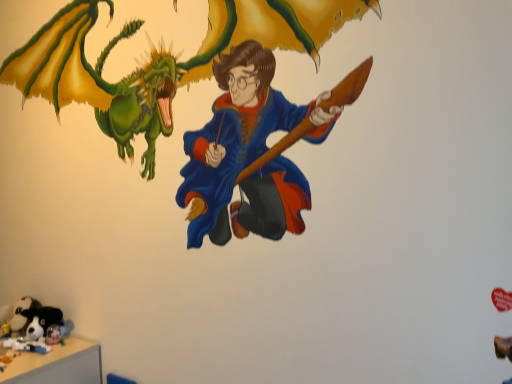
Locate an element on the screen. This screenshot has width=512, height=384. soft plush toy at bottom left is located at coordinates (33, 319).

Measure the distance between soft plush toy at bottom left and camera.

soft plush toy at bottom left and camera are 1.77 meters apart.

From the picture: Measure the distance between point (33,312) and camera.

Point (33,312) is 6.23 feet away from camera.

Describe the element at coordinates (33, 319) in the screenshot. The width and height of the screenshot is (512, 384). I see `soft plush toy at bottom left` at that location.

In order to face soft plush toy at lower left, should I rotate leftwards or rightwards?

It's best to rotate left around 29.240 degrees.

You are a GUI agent. You are given a task and a screenshot of the screen. Output one action in this format:
    pyautogui.click(x=<x>, y=<y>)
    Task: Click on the soft plush toy at lower left
    The height and width of the screenshot is (384, 512).
    Given the screenshot: What is the action you would take?
    pyautogui.click(x=17, y=314)

Describe the element at coordinates (17, 314) in the screenshot. I see `soft plush toy at lower left` at that location.

What is the approximate width of soft plush toy at lower left?

soft plush toy at lower left is 16.98 centimeters wide.

At what (x,y) coordinates should I click in order to perform the action: click on soft plush toy at bottom left. Please return your answer as a coordinate pair (x, y). The height and width of the screenshot is (384, 512). Looking at the image, I should click on (33, 319).

Can you confirm if soft plush toy at lower left is positioned to the right of soft plush toy at bottom left?

No, soft plush toy at lower left is not to the right of soft plush toy at bottom left.

Between soft plush toy at lower left and soft plush toy at bottom left, which one is positioned in front?

soft plush toy at bottom left.

Is point (25, 308) positioned after point (19, 307)?

No, it is in front of (19, 307).

From the image's perspective, which one is positioned lower, soft plush toy at lower left or soft plush toy at bottom left?

soft plush toy at lower left.

Consider the image. From a real-world perspective, who is located lower, soft plush toy at lower left or soft plush toy at bottom left?

From a 3D spatial view, soft plush toy at lower left is below.

Is soft plush toy at lower left wider or thinner than soft plush toy at bottom left?

Considering their sizes, soft plush toy at lower left looks slimmer than soft plush toy at bottom left.

In the scene shown: Who is taller, soft plush toy at lower left or soft plush toy at bottom left?

soft plush toy at bottom left is taller.

Who is smaller, soft plush toy at lower left or soft plush toy at bottom left?

soft plush toy at lower left is smaller.

Is soft plush toy at lower left inside or outside of soft plush toy at bottom left?

soft plush toy at lower left exists outside the volume of soft plush toy at bottom left.

Would you consider soft plush toy at lower left to be distant from soft plush toy at bottom left?

soft plush toy at lower left is near soft plush toy at bottom left, not far away.

Is soft plush toy at lower left oriented away from soft plush toy at bottom left?

No, soft plush toy at lower left is not facing away from soft plush toy at bottom left.

How different are the orientations of soft plush toy at lower left and soft plush toy at bottom left in degrees?

The angle between the facing direction of soft plush toy at lower left and the facing direction of soft plush toy at bottom left is 0.00192 degrees.

Find the location of `toy above the soft plush toy at lower left (from the image's perspective)`. toy above the soft plush toy at lower left (from the image's perspective) is located at coordinates (33, 319).

From the picture: Considering the relative positions of soft plush toy at bottom left and soft plush toy at lower left in the image provided, is soft plush toy at bottom left to the right of soft plush toy at lower left from the viewer's perspective?

Indeed, soft plush toy at bottom left is positioned on the right side of soft plush toy at lower left.

Which object is further away from the camera, soft plush toy at bottom left or soft plush toy at lower left?

Positioned behind is soft plush toy at lower left.

Considering the positions of point (30, 318) and point (18, 319), is point (30, 318) closer or farther from the camera than point (18, 319)?

Point (30, 318).

In the scene shown: From the image's perspective, which is above, soft plush toy at bottom left or soft plush toy at lower left?

soft plush toy at bottom left.

From a real-world perspective, is soft plush toy at bottom left on soft plush toy at lower left?

Correct, in the physical world, soft plush toy at bottom left is higher than soft plush toy at lower left.

Between soft plush toy at bottom left and soft plush toy at lower left, which one has smaller width?

Thinner between the two is soft plush toy at lower left.

Considering the sizes of soft plush toy at bottom left and soft plush toy at lower left in the image, is soft plush toy at bottom left taller or shorter than soft plush toy at lower left?

Clearly, soft plush toy at bottom left is taller compared to soft plush toy at lower left.

Does soft plush toy at bottom left have a smaller size compared to soft plush toy at lower left?

No.

Do you think soft plush toy at bottom left is within soft plush toy at lower left, or outside of it?

soft plush toy at bottom left is outside soft plush toy at lower left.

Are soft plush toy at bottom left and soft plush toy at lower left making contact?

Yes, soft plush toy at bottom left is right next to soft plush toy at lower left and making contact.

Consider the image. Could you tell me if soft plush toy at bottom left is turned towards soft plush toy at lower left?

No.

Can you tell me how much soft plush toy at bottom left and soft plush toy at lower left differ in facing direction?

0.00192 degrees separate the facing orientations of soft plush toy at bottom left and soft plush toy at lower left.

The width and height of the screenshot is (512, 384). What are the coordinates of `animal located underneath the soft plush toy at bottom left (from a real-world perspective)` in the screenshot? It's located at (17, 314).

This screenshot has width=512, height=384. Identify the location of toy located on the right of soft plush toy at lower left. (33, 319).

You are a GUI agent. You are given a task and a screenshot of the screen. Output one action in this format:
    pyautogui.click(x=<x>, y=<y>)
    Task: Click on the toy in front of the soft plush toy at lower left
    
    Given the screenshot: What is the action you would take?
    pyautogui.click(x=33, y=319)